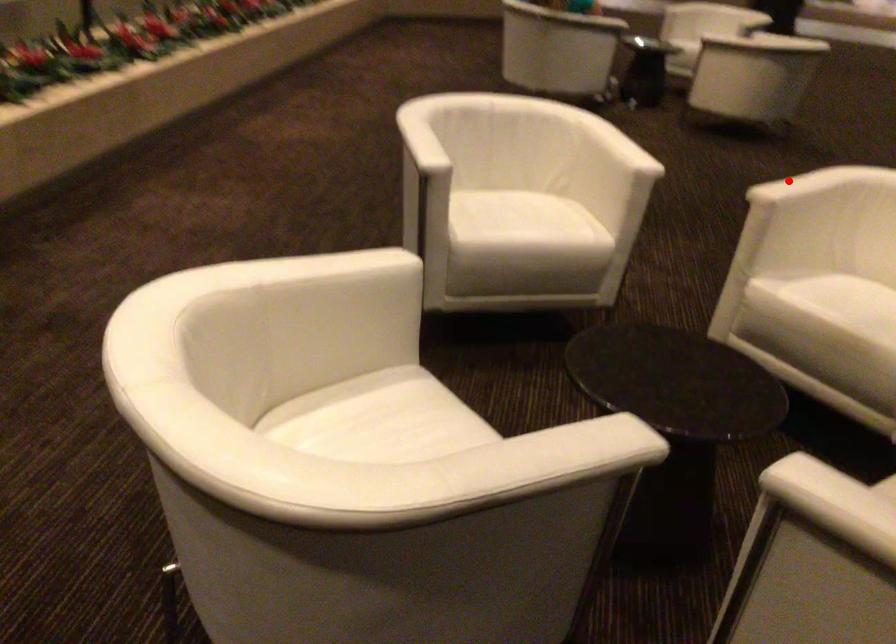
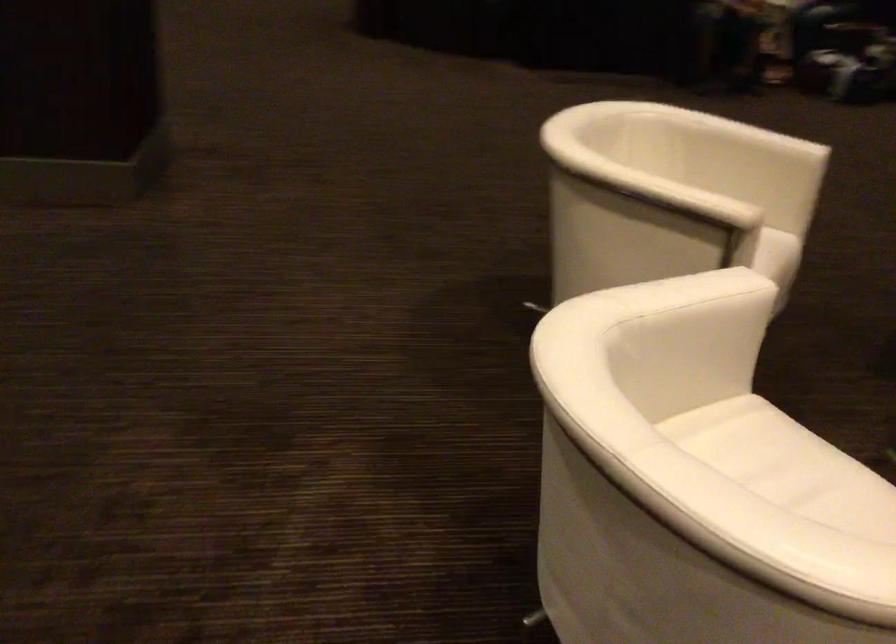
Question: I am providing you with two images of the same scene from different viewpoints. Given a red point in image1, look at the same physical point in image2. Is it:

Choices:
 (A) Closer to the viewpoint
 (B) Farther from the viewpoint

Answer: (A)